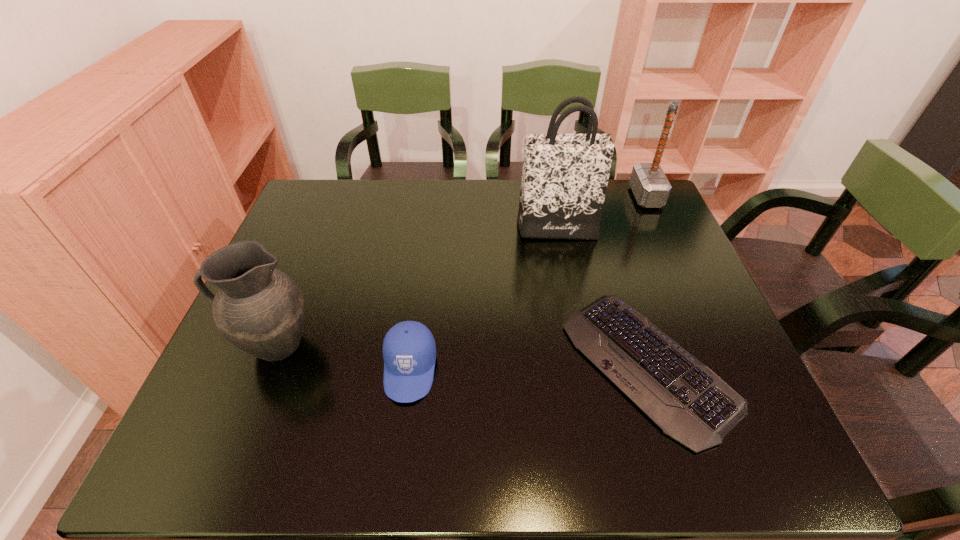
Find the location of a particular element. This screenshot has height=540, width=960. object that is at the near right corner is located at coordinates (690, 403).

At what (x,y) coordinates should I click in order to perform the action: click on vacant point at the far edge. Please return your answer as a coordinate pair (x, y). Looking at the image, I should click on (463, 180).

Where is `free space at the near edge of the desktop`? The image size is (960, 540). free space at the near edge of the desktop is located at coordinates (455, 447).

Locate an element on the screen. This screenshot has width=960, height=540. vacant space at the left edge of the desktop is located at coordinates (294, 280).

Find the location of a particular element. The height and width of the screenshot is (540, 960). vacant space at the right edge of the desktop is located at coordinates (670, 288).

This screenshot has height=540, width=960. In order to click on free space at the far left corner in this screenshot , I will do `click(339, 194)`.

The height and width of the screenshot is (540, 960). Identify the location of vacant space at the near left corner of the desktop. (227, 448).

Locate an element on the screen. The height and width of the screenshot is (540, 960). empty space between the farthest object and the computer keyboard is located at coordinates (646, 281).

Image resolution: width=960 pixels, height=540 pixels. In order to click on free space between the shopping bag and the leftmost object in this screenshot , I will do `click(416, 287)`.

Locate an element on the screen. empty location between the computer keyboard and the cap is located at coordinates (529, 368).